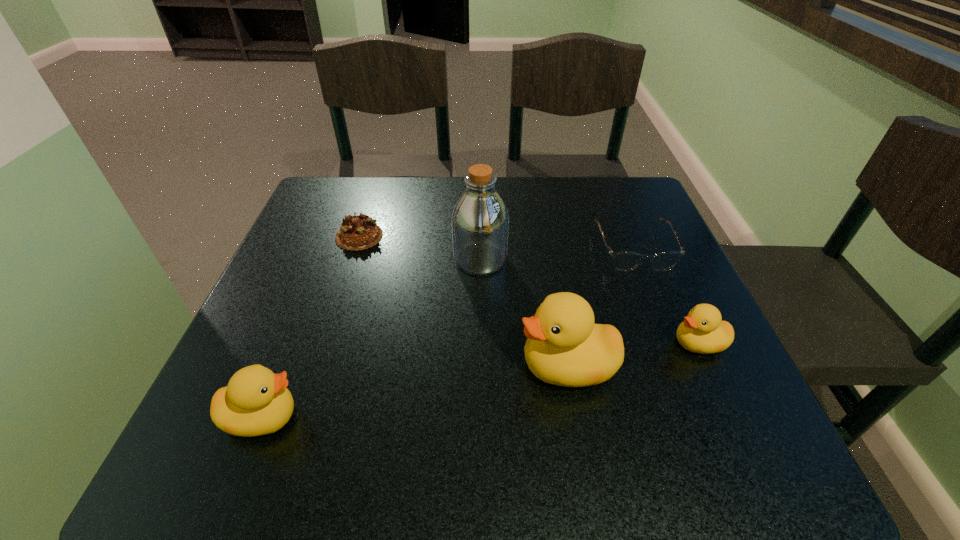
Locate an element on the screen. The height and width of the screenshot is (540, 960). the leftmost duckling is located at coordinates (256, 402).

Find the location of a particular element. This screenshot has height=540, width=960. the fourth shortest object is located at coordinates (256, 402).

You are a GUI agent. You are given a task and a screenshot of the screen. Output one action in this format:
    pyautogui.click(x=<x>, y=<y>)
    Task: Click on the tallest duckling
    The width and height of the screenshot is (960, 540).
    Given the screenshot: What is the action you would take?
    pyautogui.click(x=564, y=347)

The width and height of the screenshot is (960, 540). What are the coordinates of `the second duckling from left to right` in the screenshot? It's located at (564, 347).

This screenshot has height=540, width=960. I want to click on the rightmost duckling, so click(702, 331).

Where is `the fourth tallest object`? The width and height of the screenshot is (960, 540). the fourth tallest object is located at coordinates (702, 331).

Where is `chocolate cake`? chocolate cake is located at coordinates (359, 232).

This screenshot has width=960, height=540. Find the location of `the fourth object from right to left`. the fourth object from right to left is located at coordinates (480, 220).

This screenshot has height=540, width=960. What are the coordinates of `bottle` in the screenshot? It's located at (480, 220).

Where is `spectacles`? This screenshot has width=960, height=540. spectacles is located at coordinates (624, 261).